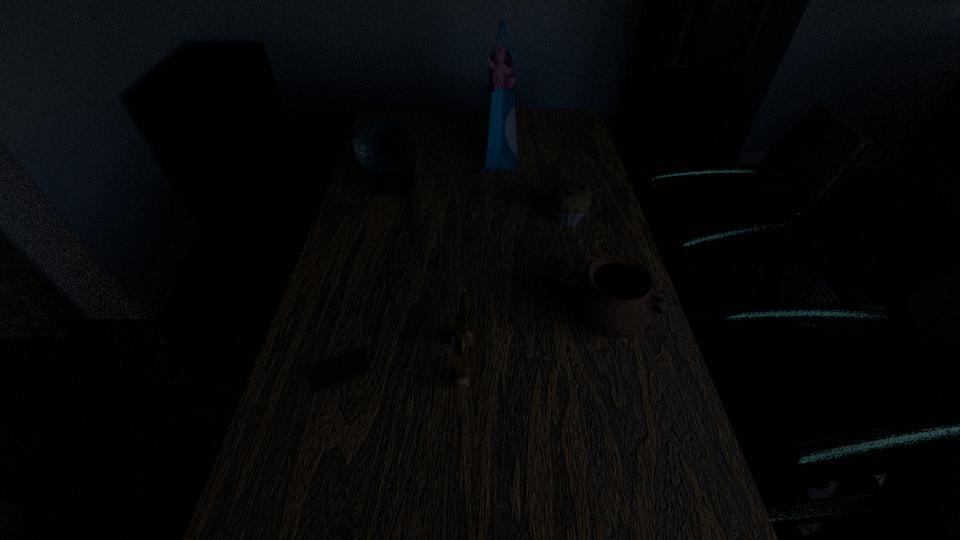
Find the location of a particular element. Image resolution: width=960 pixels, height=540 pixels. vacant space located 0.350m on the front-facing side of the third object from left to right is located at coordinates (638, 364).

Where is `vacant point located on the left of the pottery`? vacant point located on the left of the pottery is located at coordinates (452, 322).

Identify the location of vacant point located 0.200m on the left of the fourth nearest object. The width and height of the screenshot is (960, 540). (478, 219).

Find the location of a particular element. The image size is (960, 540). free point located 0.340m on the right of the candy bar is located at coordinates (533, 372).

At what (x,y) coordinates should I click in order to perform the action: click on object that is positioned at the far edge. Please return your answer as a coordinate pair (x, y). This screenshot has height=540, width=960. Looking at the image, I should click on (499, 133).

Locate an element on the screen. phonograph_record located at the left edge is located at coordinates (382, 145).

Identify the location of candy bar that is at the left edge. Image resolution: width=960 pixels, height=540 pixels. (355, 365).

At what (x,y) coordinates should I click in order to perform the action: click on pottery positioned at the right edge. Please return your answer as a coordinate pair (x, y). Image resolution: width=960 pixels, height=540 pixels. Looking at the image, I should click on (614, 297).

Locate an element on the screen. muffin that is at the right edge is located at coordinates (570, 199).

This screenshot has width=960, height=540. I want to click on free space at the left edge of the desktop, so click(388, 241).